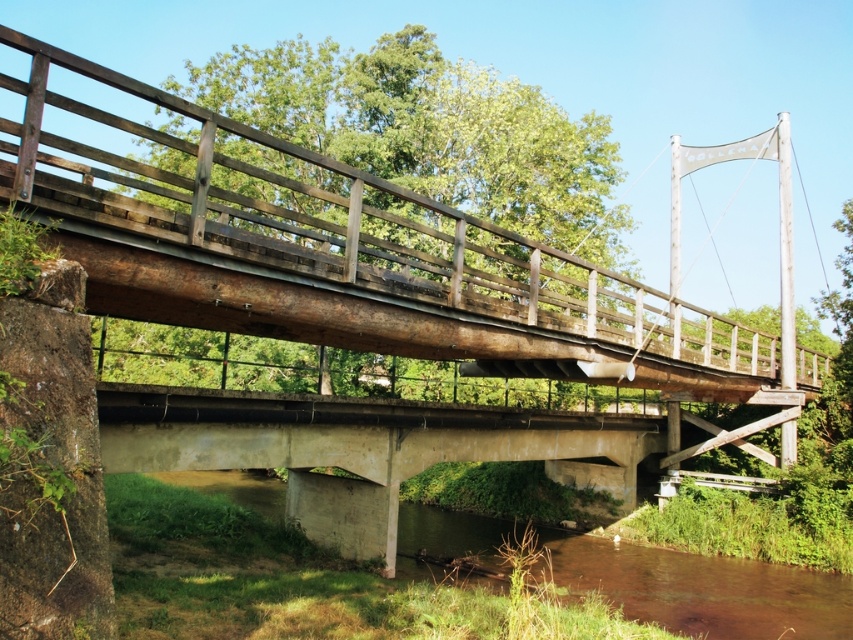
Is rusty wood rail at upper center below brown concrete river at lower center?

Incorrect, rusty wood rail at upper center is not positioned below brown concrete river at lower center.

Is point (201, 204) more distant than point (686, 563)?

No, (201, 204) is closer to viewer.

Which is behind, point (111, 168) or point (840, 576)?

The point (840, 576) is behind.

Identify the location of rusty wood rail at upper center. (335, 252).